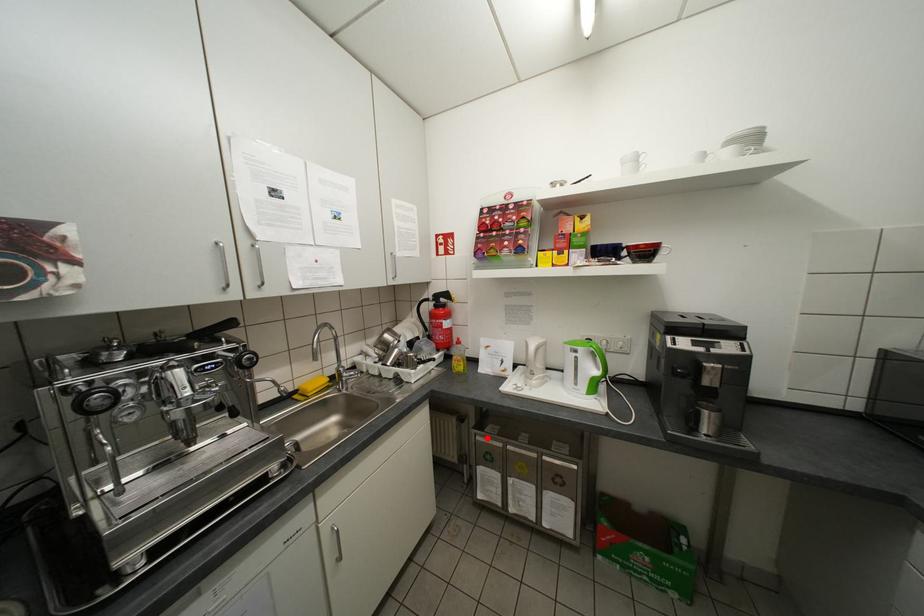
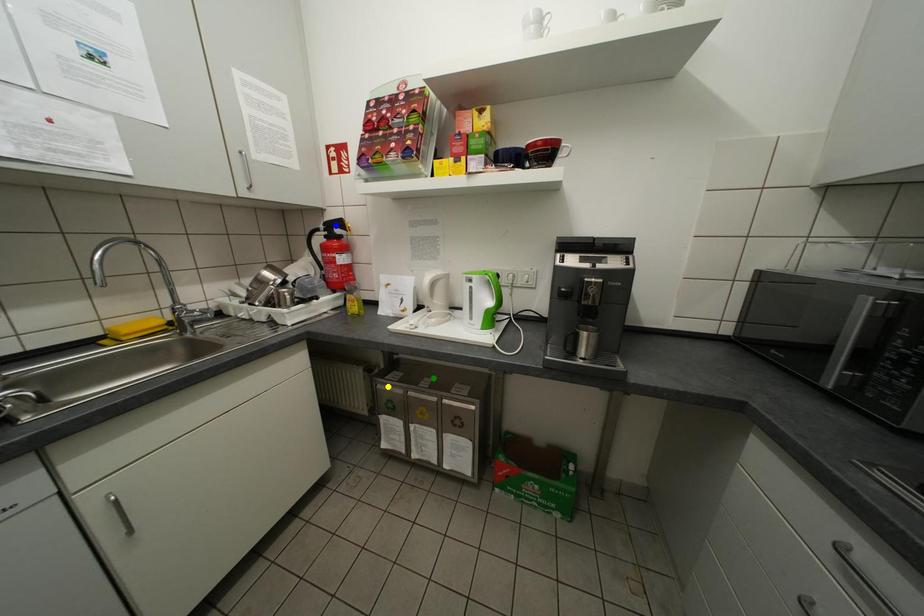
Question: I am providing you with two images of the same scene from different viewpoints. A red point is marked on the first image. You are given multiple points on the second image. In image 2, which mark is for the same physical point as the one in image 1?

Choices:
 (A) green point
 (B) yellow point
 (C) blue point

Answer: (B)